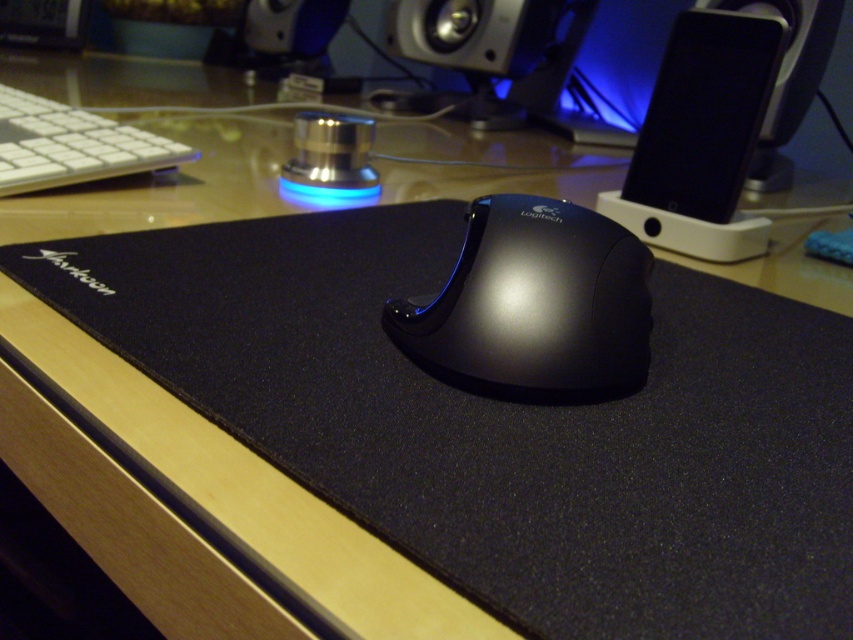
You are organizing your desk and need to place a new 12 inch wide laptop between the white matte keyboard at upper left and the metallic silver speaker at upper center. Can the laptop fit between them without overlapping either object?

The distance between the white matte keyboard at upper left and the metallic silver speaker at upper center is 31.51 inches, which is more than enough to fit a 12 inch wide laptop between them without overlapping either object.